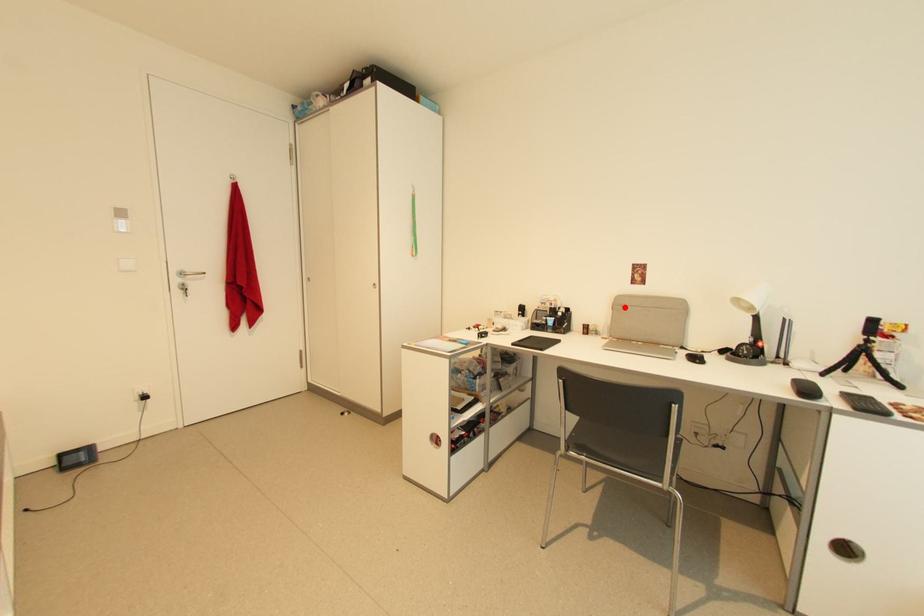
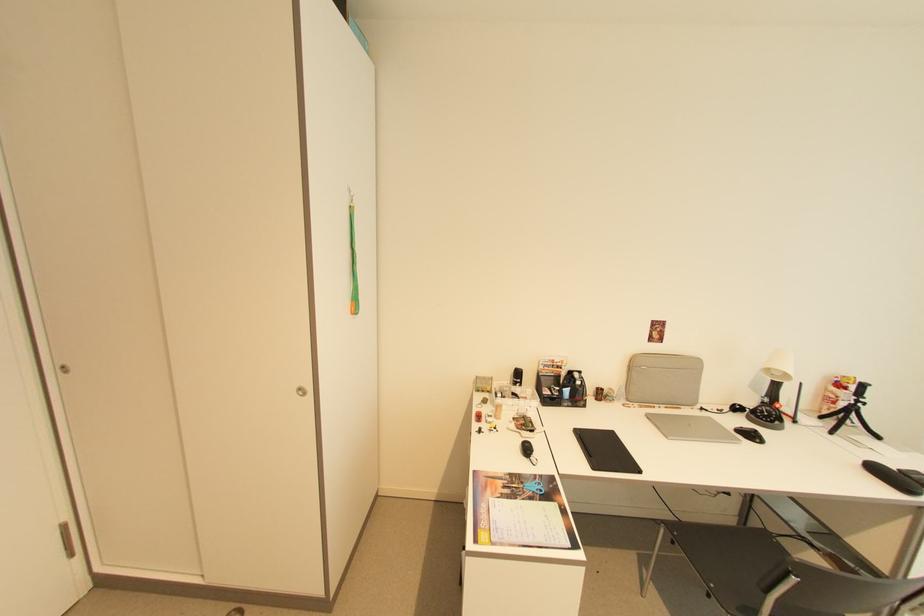
Locate, in the second image, the point that corresponds to the highlighted location in the first image.

(638, 366)